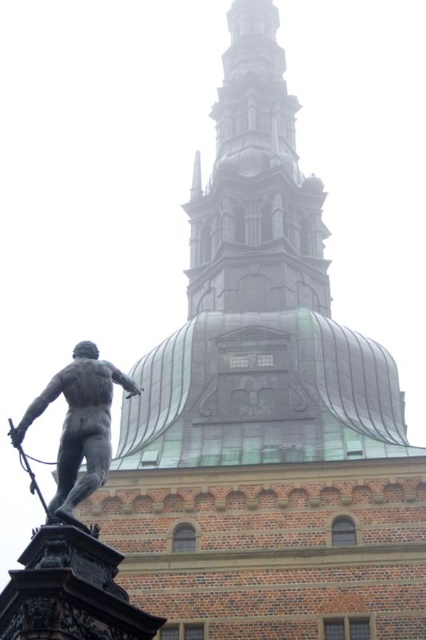
Is green copper dome at upper center taller than polished bronze statue at center?

Correct, green copper dome at upper center is much taller as polished bronze statue at center.

Can you confirm if green copper dome at upper center is thinner than polished bronze statue at center?

Incorrect, green copper dome at upper center's width is not less than polished bronze statue at center's.

Is point (327, 284) closer to viewer compared to point (74, 445)?

No, it is behind (74, 445).

At what (x,y) coordinates should I click in order to perform the action: click on green copper dome at upper center. Please return your answer as a coordinate pair (x, y). Image resolution: width=426 pixels, height=640 pixels. Looking at the image, I should click on (256, 186).